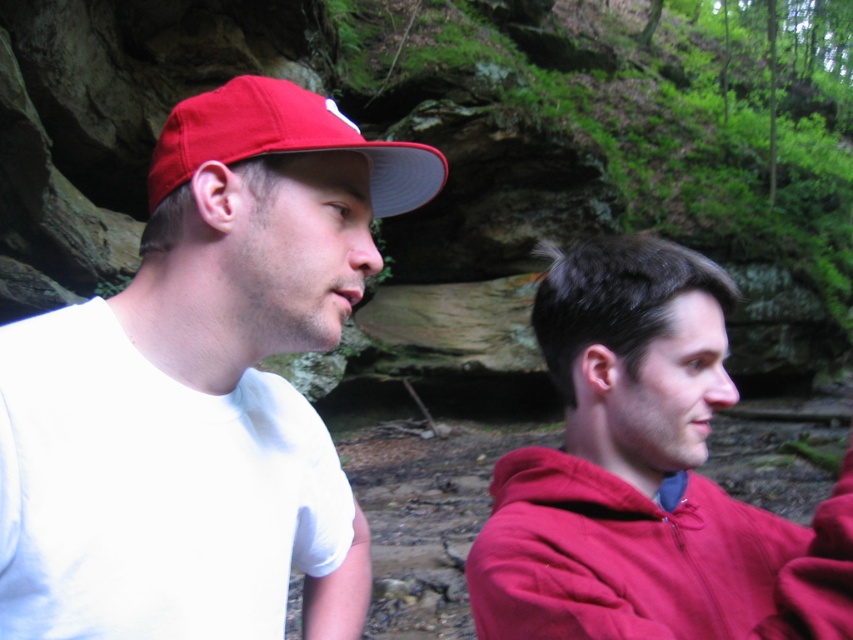
You are a hiker who wants to wear the matte red hoodie at right and the matte red sweatshirt at right. However, you can only wear one of them at a time. Based on their positions in the image, which one is more accessible to you?

The matte red hoodie at right is above the matte red sweatshirt at right, so it is more accessible to you since it is positioned higher and likely easier to reach.

You are a photographer trying to capture a photo of both the matte red hoodie at right and the matte red sweatshirt at right. Since you want them both in the frame, which direction should you move your camera to include both objects?

The matte red hoodie at right is to the right of the matte red sweatshirt at right. To include both in the frame, move the camera to the left so that both the matte red hoodie at right and the matte red sweatshirt at right are visible.